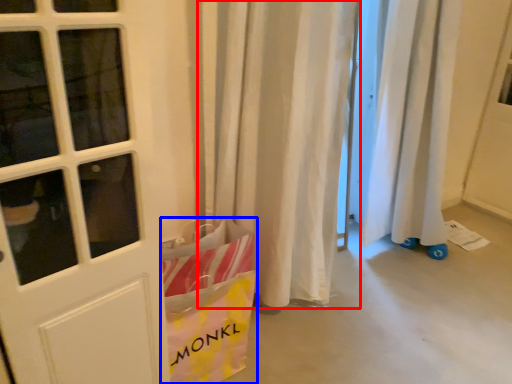
Question: Which object appears closest to the camera in this image, curtain (highlighted by a red box) or grocery bag (highlighted by a blue box)?

Choices:
 (A) curtain
 (B) grocery bag

Answer: (A)